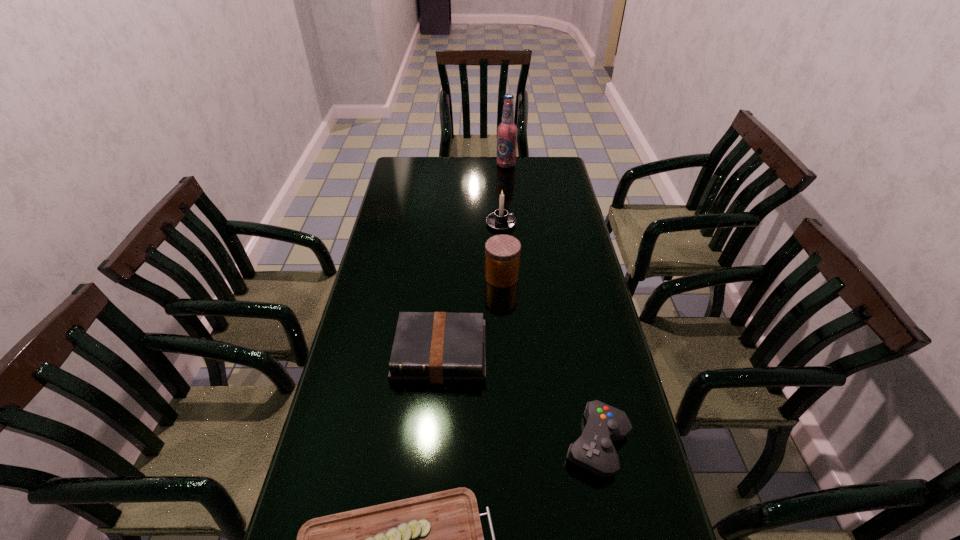
Find the location of `free spot located on the spine side of the hardback book`. free spot located on the spine side of the hardback book is located at coordinates coord(430,470).

In order to click on vacant space positioned 0.280m on the left of the second nearest object in this screenshot , I will do `click(449, 443)`.

The height and width of the screenshot is (540, 960). What are the coordinates of `object located in the far edge section of the desktop` in the screenshot? It's located at (507, 131).

Identify the location of object positioned at the left edge. (429, 347).

Identify the location of object present at the right edge. This screenshot has height=540, width=960. (594, 451).

This screenshot has width=960, height=540. I want to click on vacant space at the far edge, so click(x=468, y=161).

This screenshot has width=960, height=540. Identify the location of vacant area at the left edge of the desktop. (402, 184).

Locate an element on the screen. The width and height of the screenshot is (960, 540). free space at the right edge is located at coordinates (601, 336).

The image size is (960, 540). Identify the location of free space at the far left corner. (407, 178).

The width and height of the screenshot is (960, 540). What are the coordinates of `vacant space at the far right corner of the desktop` in the screenshot? It's located at (564, 180).